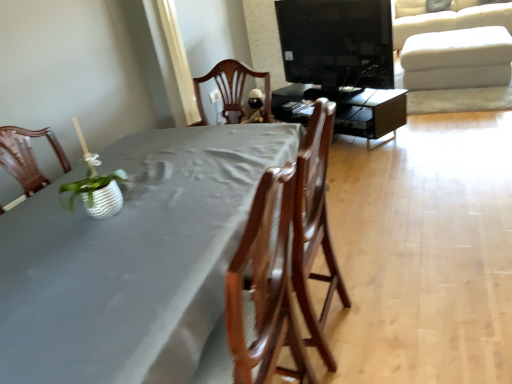
Question: Considering the relative positions of white textured pot at left and black glossy tv at upper center in the image provided, is white textured pot at left in front of black glossy tv at upper center?

Choices:
 (A) yes
 (B) no

Answer: (A)

Question: From the image's perspective, is white textured pot at left beneath black glossy tv at upper center?

Choices:
 (A) yes
 (B) no

Answer: (A)

Question: Does white textured pot at left have a greater width compared to black glossy tv at upper center?

Choices:
 (A) yes
 (B) no

Answer: (B)

Question: Is white textured pot at left behind black glossy tv at upper center?

Choices:
 (A) yes
 (B) no

Answer: (B)

Question: Is white textured pot at left surrounding black glossy tv at upper center?

Choices:
 (A) yes
 (B) no

Answer: (B)

Question: Do you think wooden chair at center is within white textured pot at left, or outside of it?

Choices:
 (A) outside
 (B) inside

Answer: (A)

Question: Considering the positions of point (314, 334) and point (117, 206), is point (314, 334) closer or farther from the camera than point (117, 206)?

Choices:
 (A) farther
 (B) closer

Answer: (A)

Question: Visually, is wooden chair at center positioned to the left or to the right of white textured pot at left?

Choices:
 (A) right
 (B) left

Answer: (A)

Question: From a real-world perspective, is wooden chair at center physically located above or below white textured pot at left?

Choices:
 (A) below
 (B) above

Answer: (A)

Question: Considering their positions, is black glossy tv at upper center located in front of or behind white fabric ottoman at upper right?

Choices:
 (A) behind
 (B) front

Answer: (B)

Question: Considering the positions of point (335, 114) and point (485, 91), is point (335, 114) closer or farther from the camera than point (485, 91)?

Choices:
 (A) closer
 (B) farther

Answer: (A)

Question: From a real-world perspective, is black glossy tv at upper center physically located above or below white fabric ottoman at upper right?

Choices:
 (A) above
 (B) below

Answer: (A)

Question: From the image's perspective, relative to white fabric ottoman at upper right, is black glossy tv at upper center above or below?

Choices:
 (A) above
 (B) below

Answer: (B)

Question: Based on their sizes in the image, would you say black glossy tv at upper center is bigger or smaller than matte black tv stand at center, positioned as the 1th table in back-to-front order?

Choices:
 (A) big
 (B) small

Answer: (B)

Question: From the image's perspective, is black glossy tv at upper center above or below matte black tv stand at center, positioned as the 1th table in back-to-front order?

Choices:
 (A) below
 (B) above

Answer: (B)